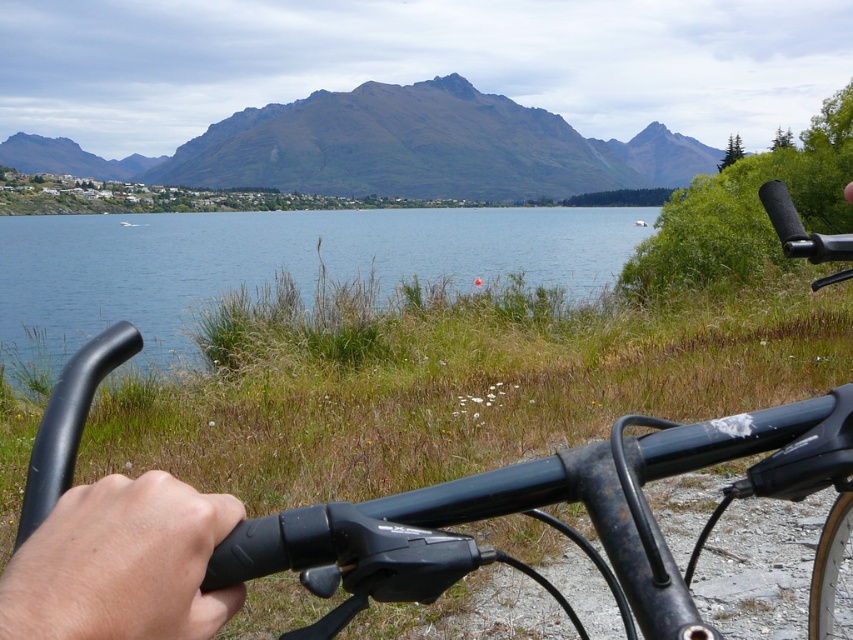
Question: Which point is farther from the camera taking this photo?

Choices:
 (A) (364, 262)
 (B) (704, 634)
 (C) (267, 173)

Answer: (C)

Question: Does matte black bicycle handlebars at center have a larger size compared to blue water at center?

Choices:
 (A) yes
 (B) no

Answer: (B)

Question: Is blue water at center bigger than brown rocky mountain at upper center?

Choices:
 (A) yes
 (B) no

Answer: (A)

Question: Considering the real-world distances, which object is closest to the blue water at center?

Choices:
 (A) brown rocky mountain at upper center
 (B) matte black bicycle handlebars at center

Answer: (A)

Question: Among these objects, which one is nearest to the camera?

Choices:
 (A) brown rocky mountain at upper center
 (B) blue water at center

Answer: (B)

Question: Can you confirm if matte black bicycle handlebars at center is smaller than blue water at center?

Choices:
 (A) yes
 (B) no

Answer: (A)